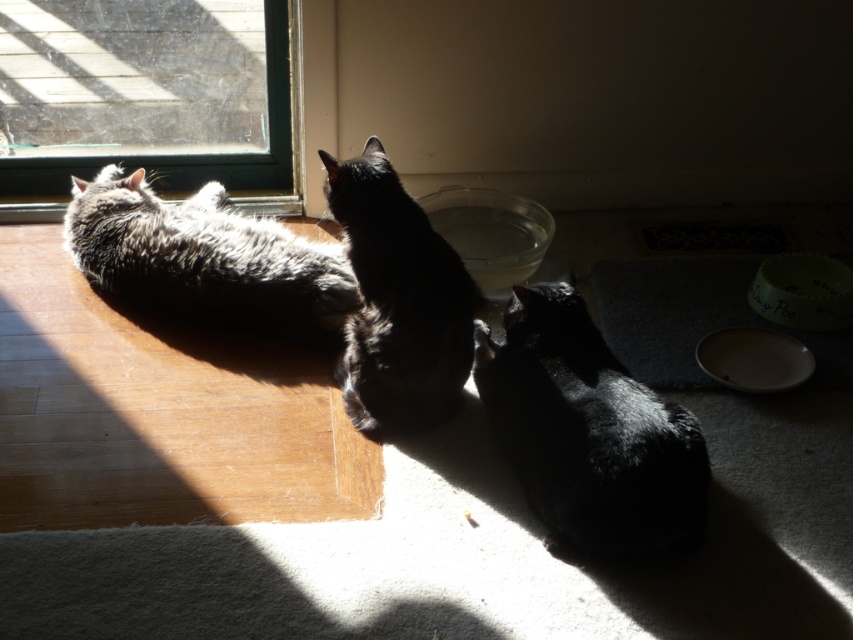
Can you confirm if transparent glass window at upper left is positioned above black glossy cat at center?

Yes, transparent glass window at upper left is above black glossy cat at center.

Can you confirm if transparent glass window at upper left is taller than black glossy cat at center?

No.

Which is in front, point (0, 204) or point (329, 180)?

Point (329, 180) is in front.

This screenshot has height=640, width=853. I want to click on transparent glass window at upper left, so click(148, 99).

Is point (672, 413) in front of point (244, 320)?

Yes.

Between black fur cat at lower right and gray-furred cat at left, which one is positioned lower?

black fur cat at lower right is below.

Where is `black fur cat at lower right`? This screenshot has height=640, width=853. black fur cat at lower right is located at coordinates (589, 433).

The image size is (853, 640). What do you see at coordinates (148, 99) in the screenshot?
I see `transparent glass window at upper left` at bounding box center [148, 99].

Who is higher up, transparent glass window at upper left or gray-furred cat at left?

transparent glass window at upper left is higher up.

Locate an element on the screen. The height and width of the screenshot is (640, 853). transparent glass window at upper left is located at coordinates (148, 99).